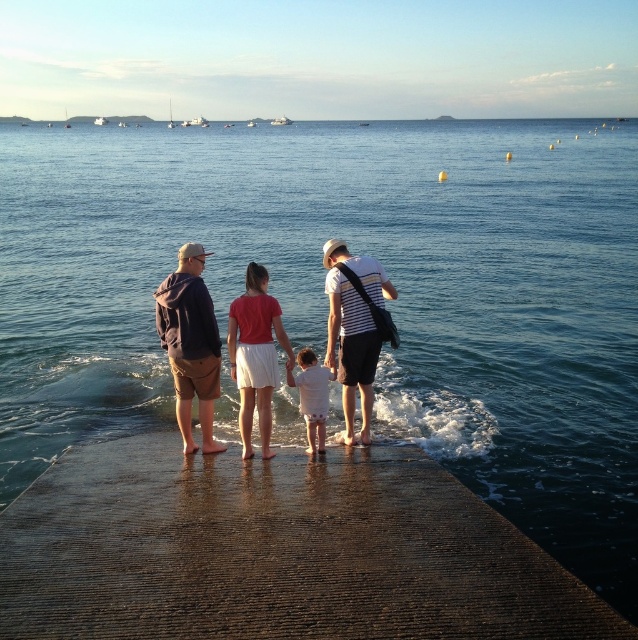
Question: Which point appears closest to the camera in this image?

Choices:
 (A) (355, 376)
 (B) (168, 461)
 (C) (175, 326)
 (D) (309, 438)

Answer: (C)

Question: Does dark blue hoodie at center have a greater width compared to striped cotton shirt at center?

Choices:
 (A) yes
 (B) no

Answer: (B)

Question: Is matte black clothing at center wider than striped cotton shirt at center?

Choices:
 (A) no
 (B) yes

Answer: (B)

Question: Estimate the real-world distances between objects in this image. Which object is closer to the dark concrete dock at center?

Choices:
 (A) striped cotton shirt at center
 (B) white cotton shirt at center

Answer: (B)

Question: Does dark concrete dock at center appear on the left side of white cotton shirt at center?

Choices:
 (A) yes
 (B) no

Answer: (A)

Question: Estimate the real-world distances between objects in this image. Which object is closer to the matte black clothing at center?

Choices:
 (A) dark concrete dock at center
 (B) striped cotton shirt at center

Answer: (B)